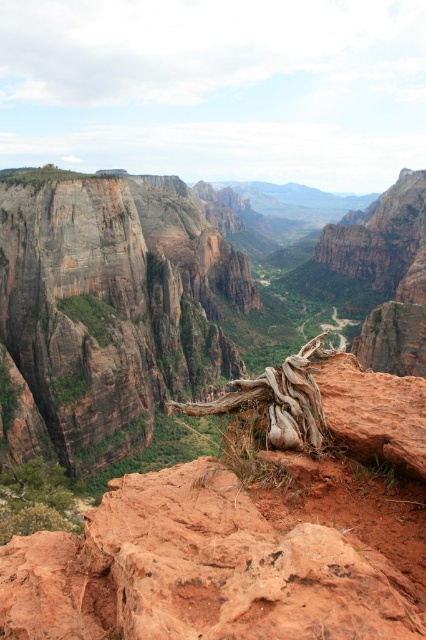
Question: Which object appears farthest from the camera in this image?

Choices:
 (A) rustic brown cliff at upper left
 (B) rustic rock canyon at center
 (C) brown rough tree root at center

Answer: (A)

Question: Where is rustic rock canyon at center located in relation to brown rough tree root at center in the image?

Choices:
 (A) left
 (B) right

Answer: (B)

Question: Which is nearer to the brown rough tree root at center?

Choices:
 (A) rustic rock canyon at center
 (B) rustic brown cliff at upper left

Answer: (B)

Question: Is the position of rustic rock canyon at center less distant than that of rustic brown cliff at upper left?

Choices:
 (A) yes
 (B) no

Answer: (A)

Question: Estimate the real-world distances between objects in this image. Which object is farther from the rustic rock canyon at center?

Choices:
 (A) rustic brown cliff at upper left
 (B) brown rough tree root at center

Answer: (B)

Question: Does rustic rock canyon at center come in front of brown rough tree root at center?

Choices:
 (A) no
 (B) yes

Answer: (B)